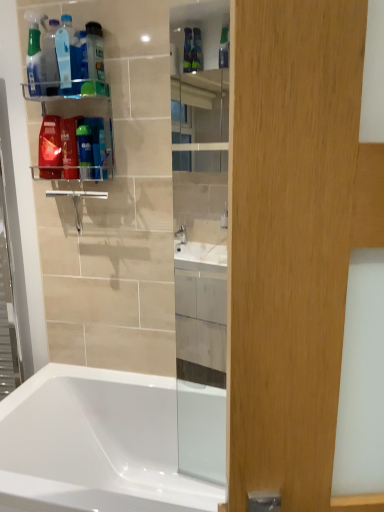
Question: Relative to clear plastic shelf at upper left, is translucent plastic bottle at upper left in front or behind?

Choices:
 (A) front
 (B) behind

Answer: (B)

Question: Is translucent plastic bottle at upper left taller or shorter than clear plastic shelf at upper left?

Choices:
 (A) short
 (B) tall

Answer: (A)

Question: Which object is the farthest from the translucent plastic bottle at upper left, placed as the 3th cleaning product when sorted from left to right?

Choices:
 (A) white glossy bathtub at lower left
 (B) translucent plastic spray bottle at upper left, which is the third cleaning product in right-to-left order
 (C) transparent glass mirror at center
 (D) translucent plastic bottle at upper left
 (E) translucent plastic shaving cream at upper left

Answer: (A)

Question: Which of these objects is positioned closest to the translucent plastic bottle at upper left?

Choices:
 (A) transparent glass mirror at center
 (B) translucent plastic bottle at upper left, which is the 1th cleaning product from right to left
 (C) white glossy bathtub at lower left
 (D) translucent plastic spray bottle at upper left, positioned as the 1th cleaning product in left-to-right order
 (E) translucent plastic bottle at upper left, the 2th cleaning product when ordered from left to right

Answer: (D)